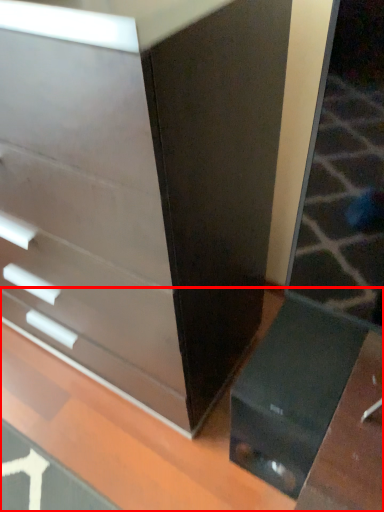
Question: From the image's perspective, what is the correct spatial positioning of table (annotated by the red box) in reference to chest of drawers?

Choices:
 (A) below
 (B) above

Answer: (A)